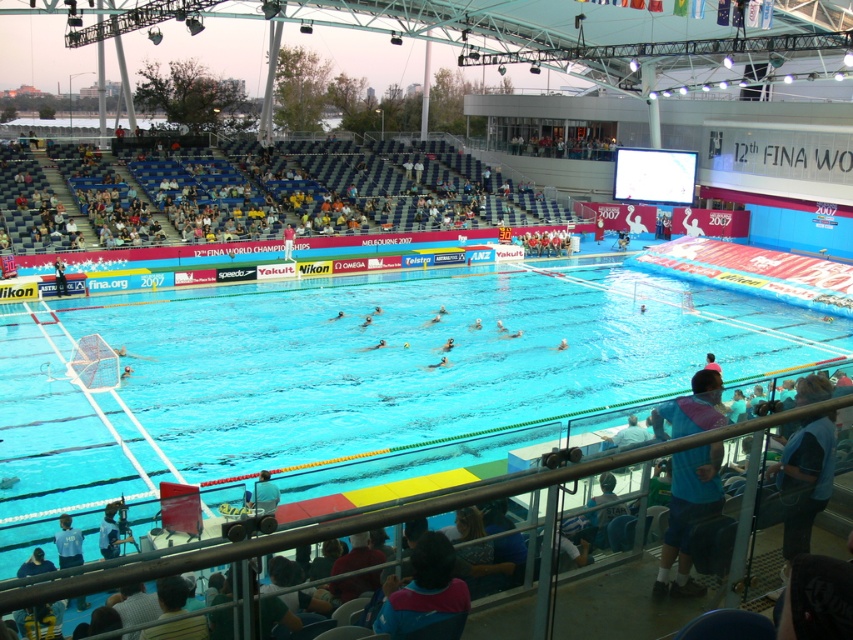
You are a photographer positioned at the front row of the stands. You want to take a photo of the two points in the pool. Which point, point (119, 536) or point (252, 504), will appear larger in your photo?

Point (119, 536) will appear larger in the photo because it is closer to the camera than point (252, 504).

You are a photographer positioned at the edge of the pool during the water polo match. You notice two blue fabrics in your viewfinder. The first is the blue fabric shirt at lower right, and the second is the blue fabric at lower center. Which of these two blue fabrics appears wider in your current view?

The blue fabric shirt at lower right appears wider than the blue fabric at lower center because its width is larger according to the description.

You are a photographer positioned at the edge of the pool during the 2007 FINA World Water Polo Championships. You notice two blue fabric shirts in the pool area. Which one is higher up in the water between the blue fabric shirt at lower right and the blue fabric shirt at lower left?

The blue fabric shirt at lower right is located above the blue fabric shirt at lower left in the water.